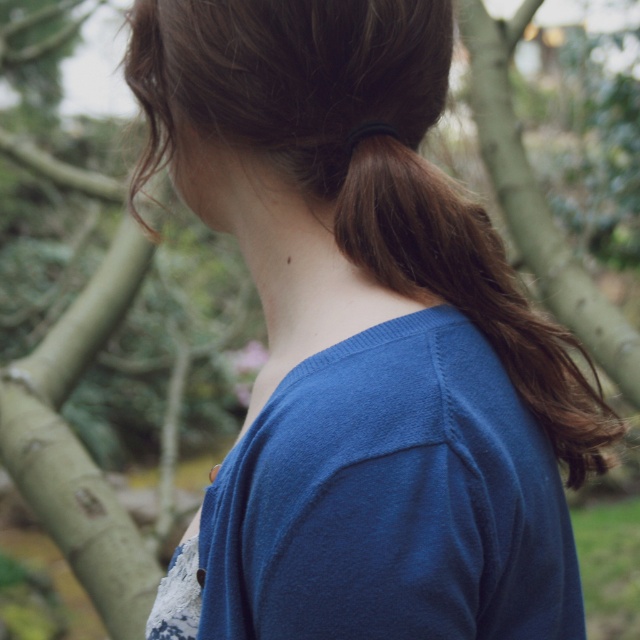
The width and height of the screenshot is (640, 640). Describe the element at coordinates (392, 500) in the screenshot. I see `blue cotton shirt at center` at that location.

Does blue cotton shirt at center have a greater height compared to brown silky hair at upper right?

Incorrect, blue cotton shirt at center's height is not larger of brown silky hair at upper right's.

This screenshot has width=640, height=640. I want to click on blue cotton shirt at center, so (x=392, y=500).